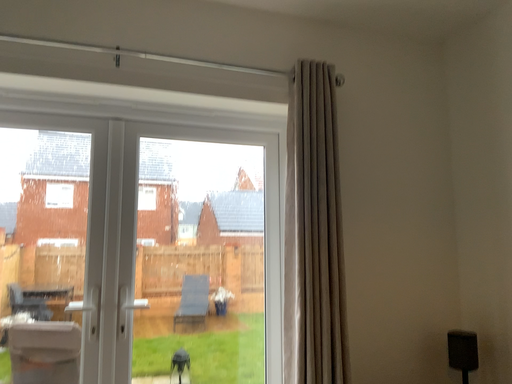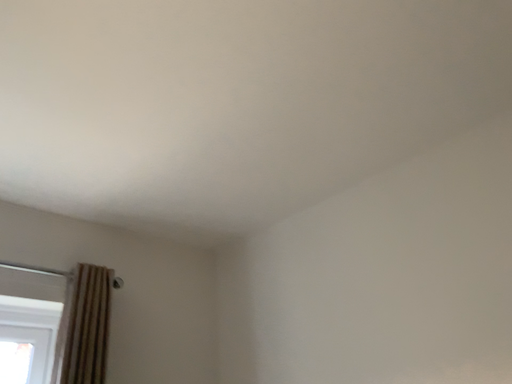
Question: Which way did the camera rotate in the video?

Choices:
 (A) rotated upward
 (B) rotated downward

Answer: (A)